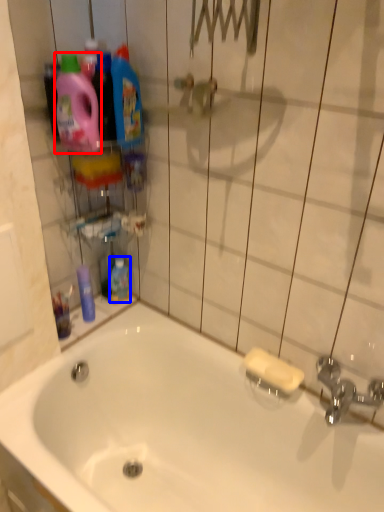
Question: Which object appears closest to the camera in this image, cleaning product (highlighted by a red box) or mouthwash (highlighted by a blue box)?

Choices:
 (A) cleaning product
 (B) mouthwash

Answer: (A)